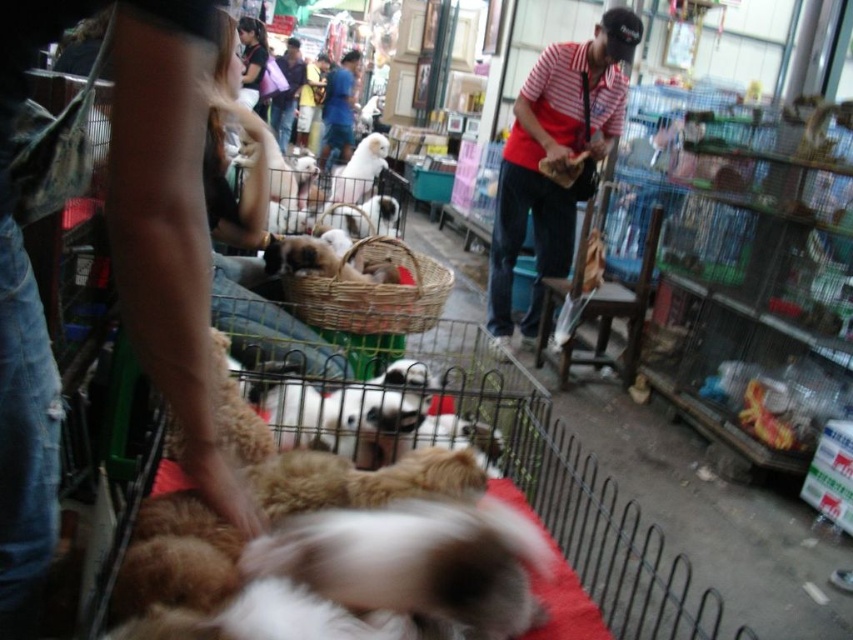
Question: Which point is closer to the camera taking this photo?

Choices:
 (A) (273, 548)
 (B) (171, 278)
 (C) (341, 145)

Answer: (B)

Question: Considering the real-world distances, which object is closest to the dark blue shirt at upper center?

Choices:
 (A) brown fur dog at lower left
 (B) fluffy brown dog at center

Answer: (B)

Question: Can you confirm if dark blue shirt at center is positioned to the right of dark blue shirt at upper center?

Choices:
 (A) no
 (B) yes

Answer: (B)

Question: Is brown fur dog at lower left bigger than fluffy brown dog at center?

Choices:
 (A) yes
 (B) no

Answer: (B)

Question: Does brown fur dog at lower left appear under woven wood basket at center?

Choices:
 (A) yes
 (B) no

Answer: (A)

Question: Which of the following is the farthest from the observer?

Choices:
 (A) click(119, 36)
 (B) click(258, 54)
 (C) click(398, 464)

Answer: (B)